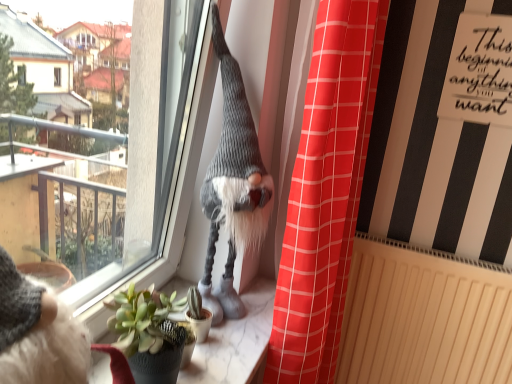
Locate an element on the screen. free area below knitted gray gnome at center (from a real-world perspective) is located at coordinates (237, 316).